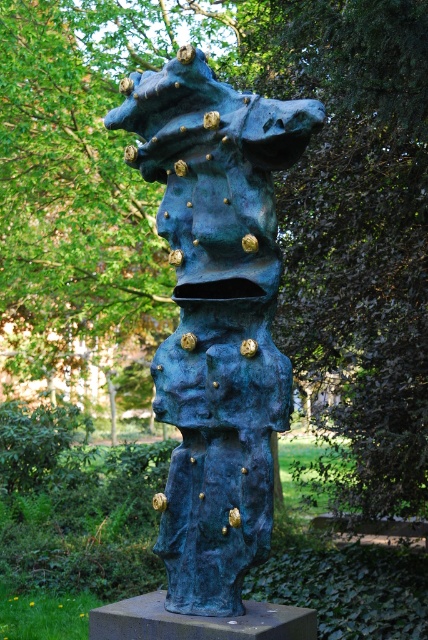
You are an art conservator tasked with cleaning the blue patinated bronze sculpture at center and the bronze pedestal at center. You have a 12 inch long cleaning tool. Can you reach the sculpture from the pedestal without moving either object?

The blue patinated bronze sculpture at center and bronze pedestal at center are 16.97 inches apart from each other. Since the tool is only 12 inches long, you cannot reach the sculpture from the pedestal without moving either object.

You are an art student standing in front of the sculpture. You notice the blue patinated bronze sculpture at center and the bronze pedestal at center. Which object is positioned to the right of the other?

The blue patinated bronze sculpture at center is to the right of the bronze pedestal at center.

You are an art student analyzing the sculpture and its pedestal. Which object occupies more space in the image, the blue patinated bronze sculpture at center or the bronze pedestal at center?

The blue patinated bronze sculpture at center has a larger size compared to the bronze pedestal at center, so it occupies more space in the image.